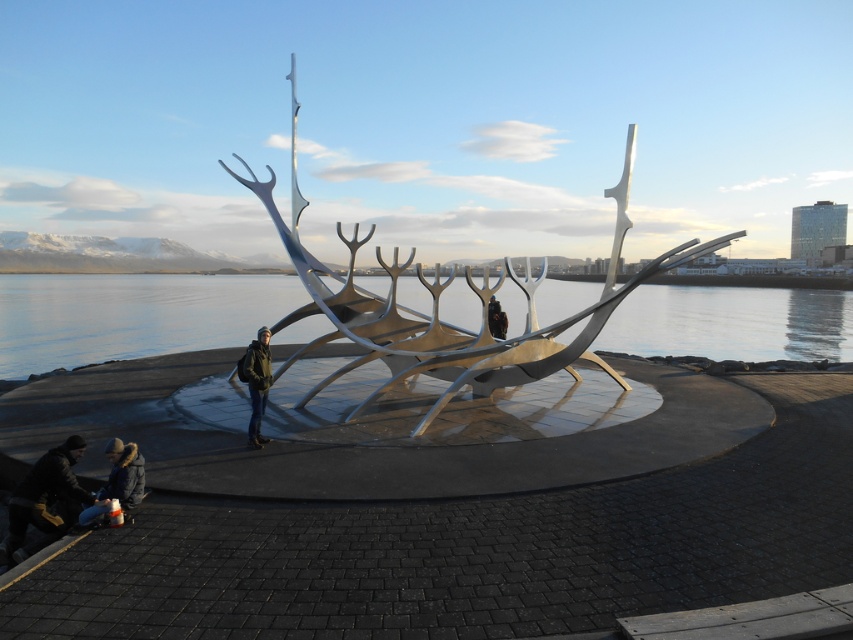
Does transparent glass water at center appear over silver metallic boat at center?

No, transparent glass water at center is not above silver metallic boat at center.

Describe the element at coordinates (131, 316) in the screenshot. The height and width of the screenshot is (640, 853). I see `transparent glass water at center` at that location.

At what (x,y) coordinates should I click in order to perform the action: click on transparent glass water at center. Please return your answer as a coordinate pair (x, y). The image size is (853, 640). Looking at the image, I should click on (131, 316).

Is point (807, 340) farther from viewer compared to point (498, 316)?

Yes.

Is transparent glass water at center closer to the viewer compared to black matte person at center?

Yes, it is.

Is point (679, 298) less distant than point (498, 337)?

That is False.

Find the location of a particular element. transparent glass water at center is located at coordinates (131, 316).

Is point (260, 337) positioned before point (503, 314)?

Yes, it is in front of point (503, 314).

Is point (239, 369) positioned after point (498, 333)?

No, it is in front of (498, 333).

Does point (267, 356) come in front of point (490, 330)?

Yes, point (267, 356) is in front of point (490, 330).

Where is `dark green jacket at center`? dark green jacket at center is located at coordinates (256, 381).